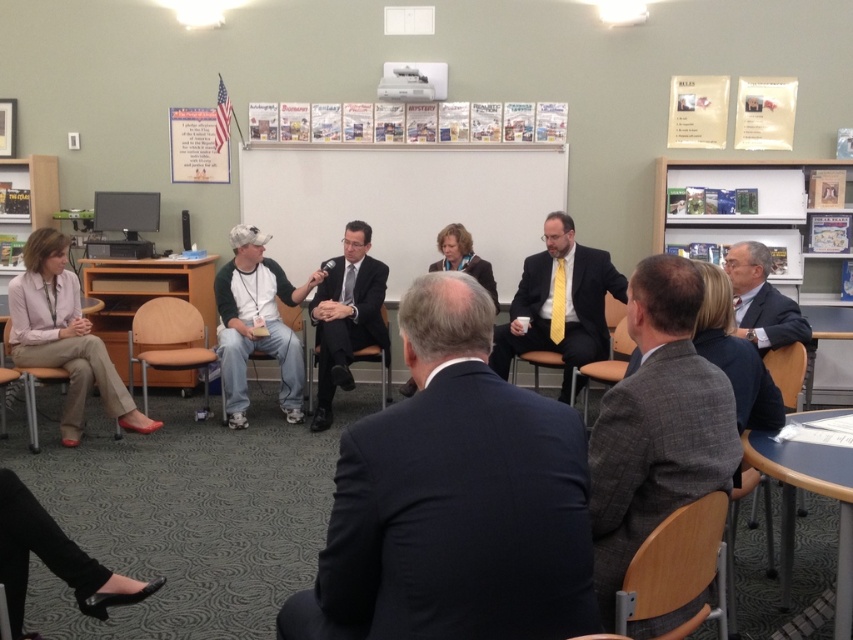
From the picture: You are a guest entering the room and need to find a seat. You see the matte pink blouse at lower left and the brown leather chair at lower center. Which object is closer to the entrance?

The brown leather chair at lower center is closer to the entrance because it is positioned at lower center, which is typically where seating is arranged near entrances in such settings.

You are a photographer planning to take a group photo of the people in the scene. You need to ensure that the matte black suit at center and the wooden chair at lower right are both in the frame. Considering their sizes, which object should you focus on to ensure both are fully visible?

The matte black suit at center is wider than the wooden chair at lower right, so focusing on the matte black suit at center will ensure both objects are fully visible in the frame.